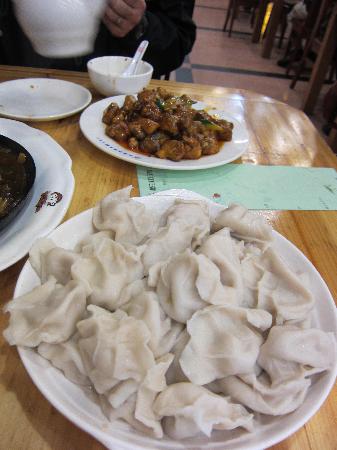
Where is `wood tabble`? This screenshot has width=337, height=450. wood tabble is located at coordinates (260, 145).